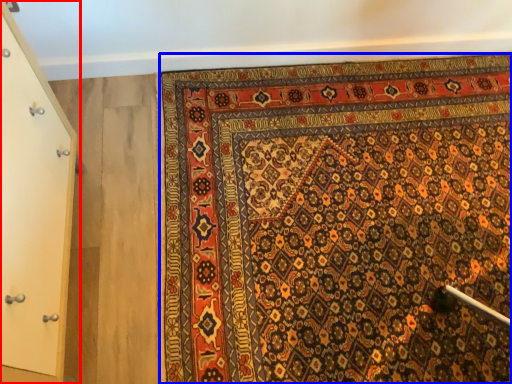
Question: Which object appears farthest to the camera in this image, door (highlighted by a red box) or mat (highlighted by a blue box)?

Choices:
 (A) door
 (B) mat

Answer: (B)